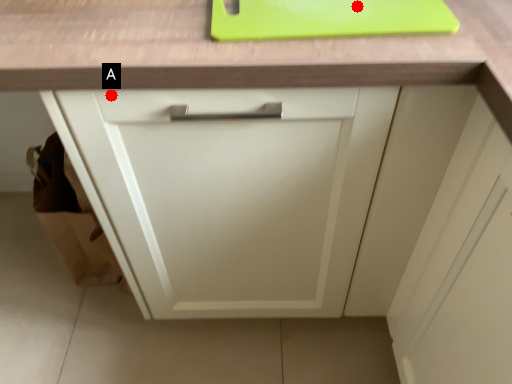
Question: Two points are circled on the image, labeled by A and B beside each circle. Which point is farther from the camera taking this photo?

Choices:
 (A) A is further
 (B) B is further

Answer: (B)